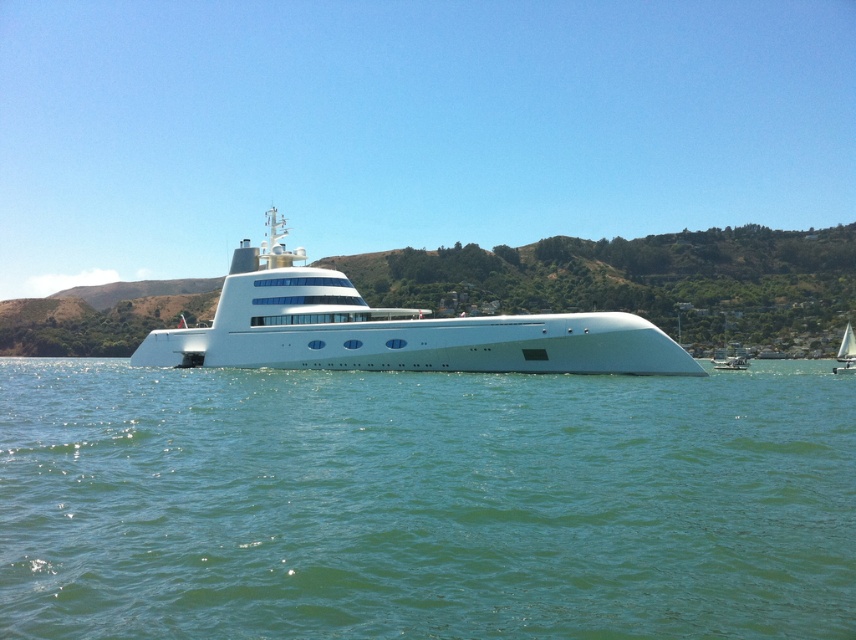
Is the position of clear blue water at center less distant than that of white glossy cruise ship at center?

That is True.

Does clear blue water at center have a larger size compared to white glossy cruise ship at center?

No, clear blue water at center is not bigger than white glossy cruise ship at center.

Which is behind, point (849, 417) or point (294, 323)?

Positioned behind is point (294, 323).

This screenshot has width=856, height=640. What are the coordinates of `clear blue water at center` in the screenshot? It's located at (424, 502).

Who is taller, clear blue water at center or white glossy sailboat at lower right?

Standing taller between the two is white glossy sailboat at lower right.

Where is `clear blue water at center`? clear blue water at center is located at coordinates click(x=424, y=502).

Which is in front, point (635, 355) or point (849, 365)?

Positioned in front is point (635, 355).

The height and width of the screenshot is (640, 856). In order to click on white glossy cruise ship at center in this screenshot , I will do `click(391, 328)`.